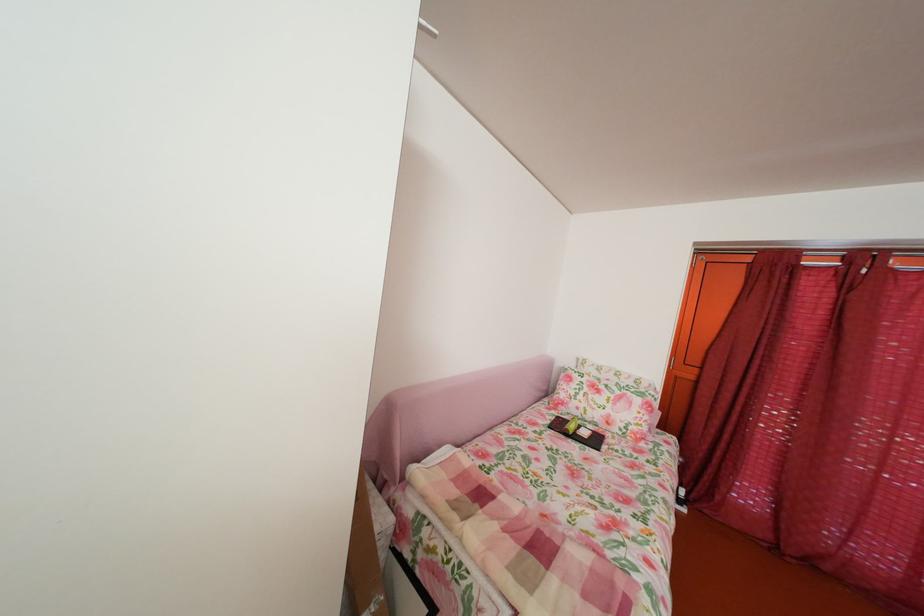
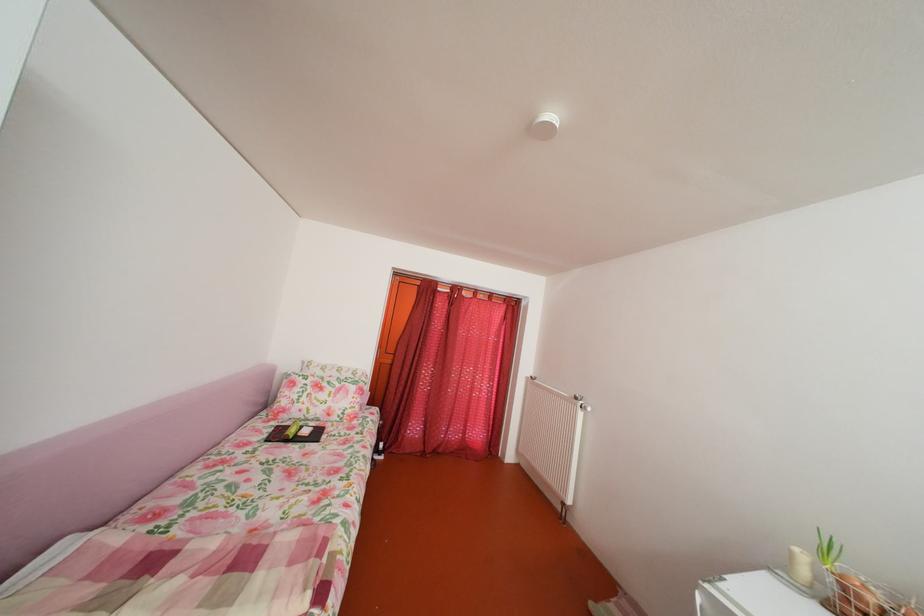
Question: The images are taken continuously from a first-person perspective. In which direction is your viewpoint rotating?

Choices:
 (A) Left
 (B) Right
 (C) Up
 (D) Down

Answer: (B)